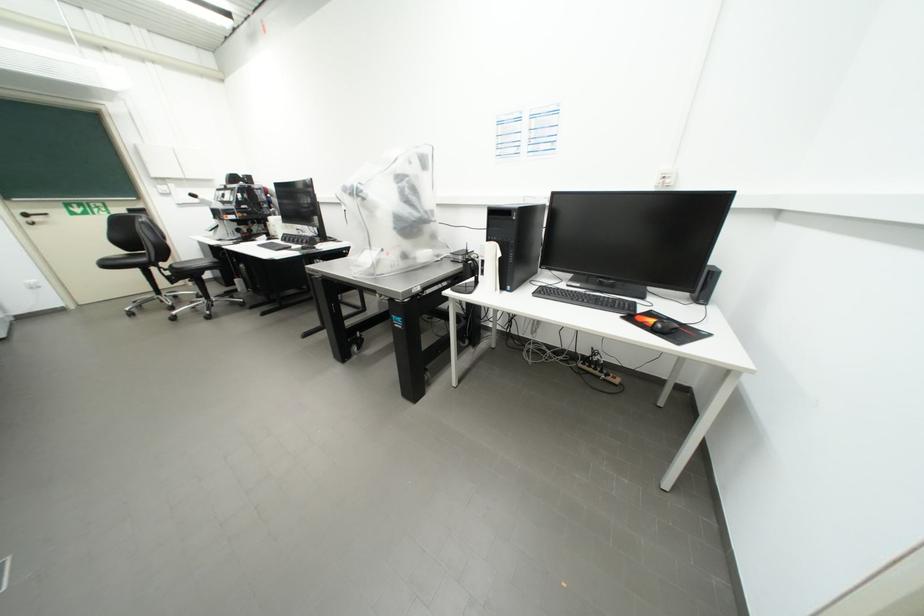
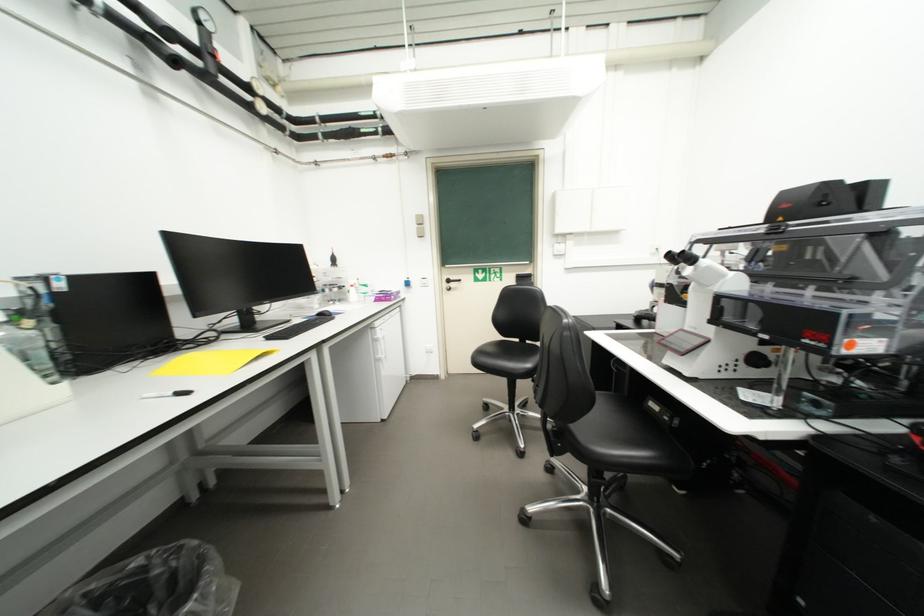
The point at (117, 265) is marked in the first image. Where is the corresponding point in the second image?

(490, 362)